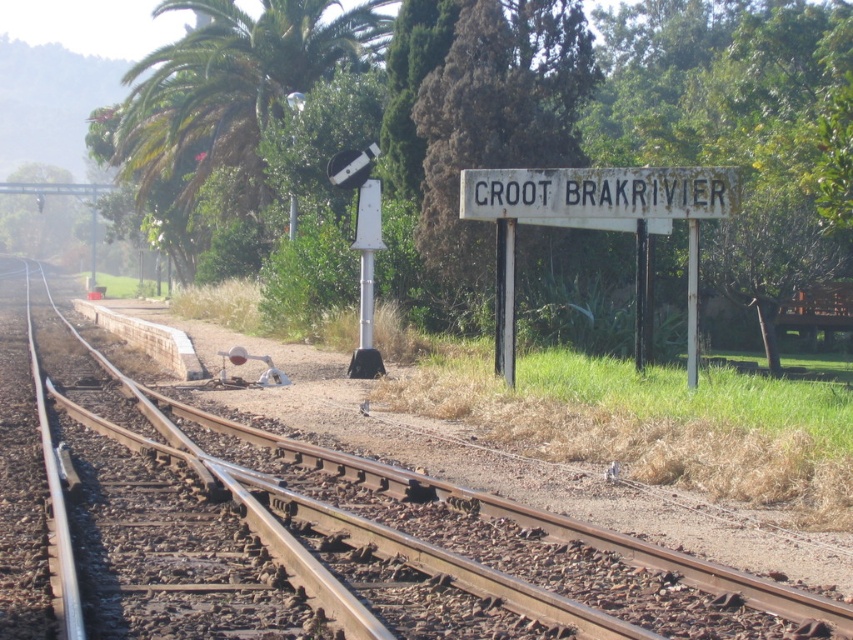
You are a railway worker checking the visibility of the white rusty sign at center. A green leafy tree at upper right is blocking part of the sign. Which object is closer to you, the observer?

The green leafy tree at upper right is positioned over the white rusty sign at center, so the tree is closer to the observer than the sign.